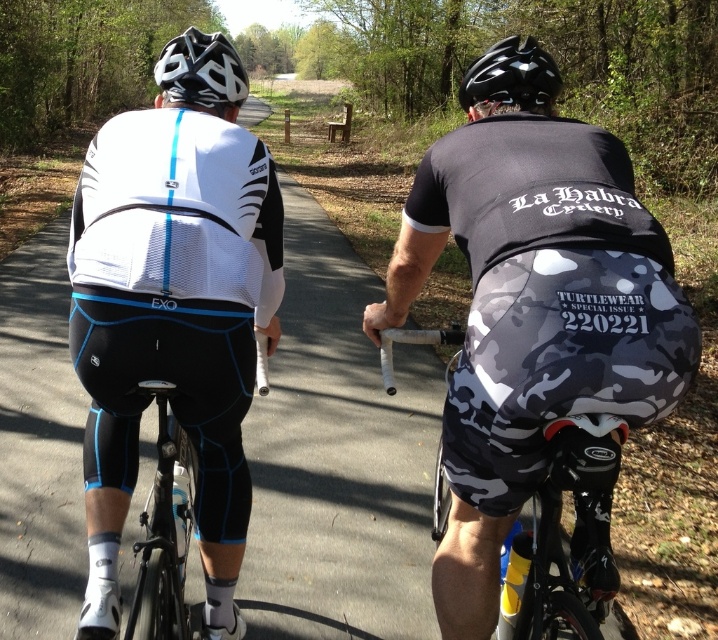
Does point (472, 132) come farther from viewer compared to point (444, 516)?

No.

Which is more to the right, camouflage fabric shorts at center or camouflage fabric bicycle at center?

Positioned to the right is camouflage fabric bicycle at center.

Who is more forward, (x=512, y=232) or (x=559, y=512)?

Point (x=512, y=232) is more forward.

This screenshot has height=640, width=718. I want to click on camouflage fabric shorts at center, so click(x=533, y=320).

Is point (225, 106) positioned behind point (518, 92)?

Yes, point (225, 106) is farther from viewer.

Is matte black helmet at upper left taller than matte black helmet at upper center?

Yes, matte black helmet at upper left is taller than matte black helmet at upper center.

Measure the distance between point (225,100) and camera.

Point (225,100) and camera are 2.39 meters apart from each other.

Find the location of a particular element. Image resolution: width=718 pixels, height=640 pixels. matte black helmet at upper left is located at coordinates (200, 72).

Can you confirm if camouflage fabric shorts at center is positioned above white matte cycling jersey at center?

Actually, camouflage fabric shorts at center is below white matte cycling jersey at center.

Which of these two, camouflage fabric shorts at center or white matte cycling jersey at center, stands shorter?

With less height is camouflage fabric shorts at center.

Where is `camouflage fabric shorts at center`? The image size is (718, 640). camouflage fabric shorts at center is located at coordinates (533, 320).

Identify the location of camouflage fabric shorts at center. (533, 320).